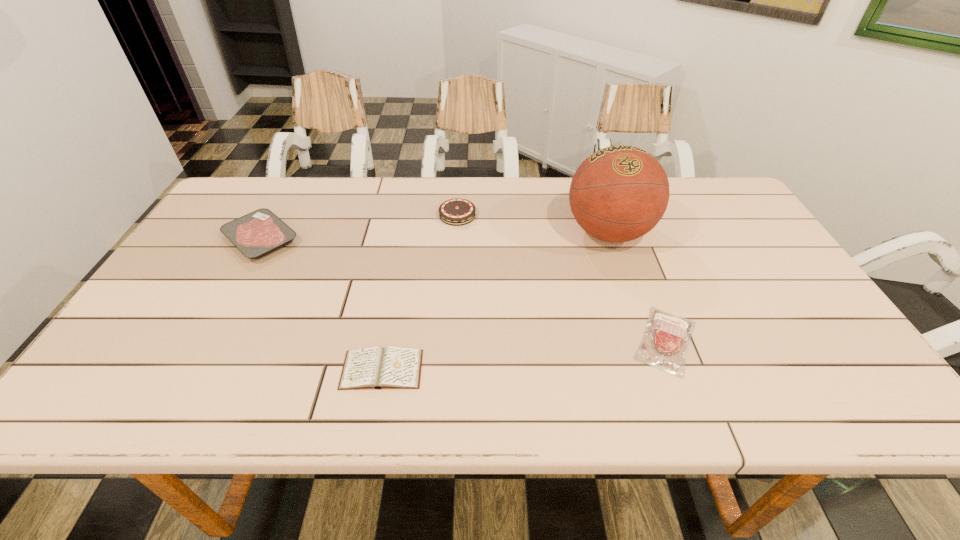
Find the location of a particular element. basketball is located at coordinates tap(619, 193).

The image size is (960, 540). What are the coordinates of `the second tallest object` in the screenshot? It's located at (455, 212).

This screenshot has height=540, width=960. Identify the location of the leftmost object. [x=256, y=234].

Locate an element on the screen. This screenshot has width=960, height=540. the left steak is located at coordinates (256, 234).

Identify the location of the shorter steak. The width and height of the screenshot is (960, 540). (664, 345).

Identify the location of the nearer steak. (664, 345).

Locate an element on the screen. The image size is (960, 540). diary is located at coordinates (375, 367).

This screenshot has width=960, height=540. I want to click on vacant space situated 0.130m on the back of the basketball, so click(x=592, y=184).

Find the location of `vacant space situated 0.090m on the back of the second tallest object`. vacant space situated 0.090m on the back of the second tallest object is located at coordinates (459, 185).

Identify the location of free location located on the back of the taller steak. The width and height of the screenshot is (960, 540). (281, 202).